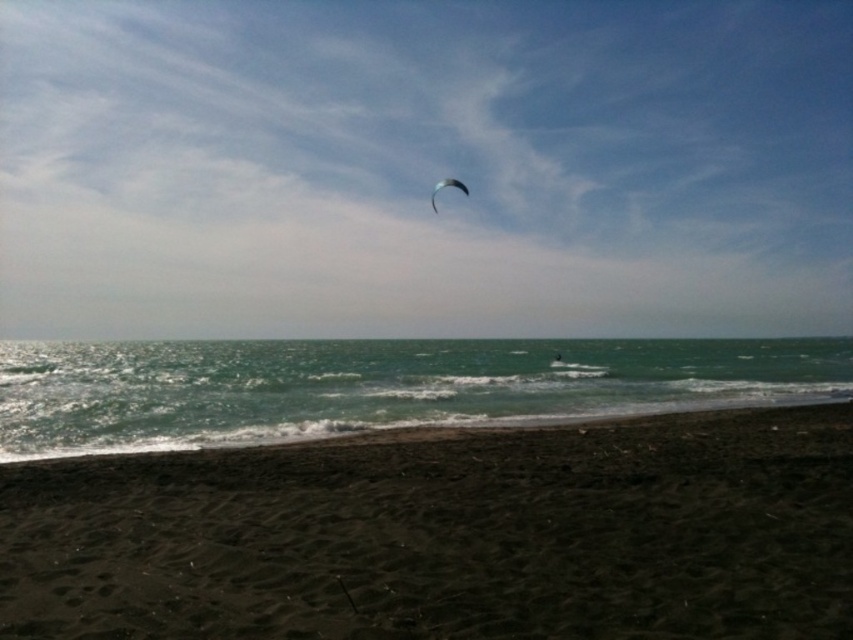
Which of these two, transparent blue kite at upper center or greenish-blue water at lower center, stands shorter?

greenish-blue water at lower center

Can you confirm if transparent blue kite at upper center is smaller than greenish-blue water at lower center?

Actually, transparent blue kite at upper center might be larger than greenish-blue water at lower center.

What do you see at coordinates (424, 168) in the screenshot? I see `transparent blue kite at upper center` at bounding box center [424, 168].

Locate an element on the screen. transparent blue kite at upper center is located at coordinates (424, 168).

Who is more distant from viewer, (824,378) or (434,205)?

Positioned behind is point (824,378).

Looking at this image, can you confirm if greenish-blue water at lower center is wider than matte black parachute at upper center?

Indeed, greenish-blue water at lower center has a greater width compared to matte black parachute at upper center.

Is point (567, 388) less distant than point (451, 186)?

No, it is not.

The image size is (853, 640). In order to click on greenish-blue water at lower center in this screenshot , I will do `click(376, 387)`.

Measure the distance from dark sand at lower center to greenish-blue water at lower center.

dark sand at lower center is 57.02 meters from greenish-blue water at lower center.

This screenshot has height=640, width=853. What do you see at coordinates (445, 534) in the screenshot? I see `dark sand at lower center` at bounding box center [445, 534].

The height and width of the screenshot is (640, 853). What are the coordinates of `dark sand at lower center` in the screenshot? It's located at (445, 534).

Find the location of a particular element. The image size is (853, 640). dark sand at lower center is located at coordinates (445, 534).